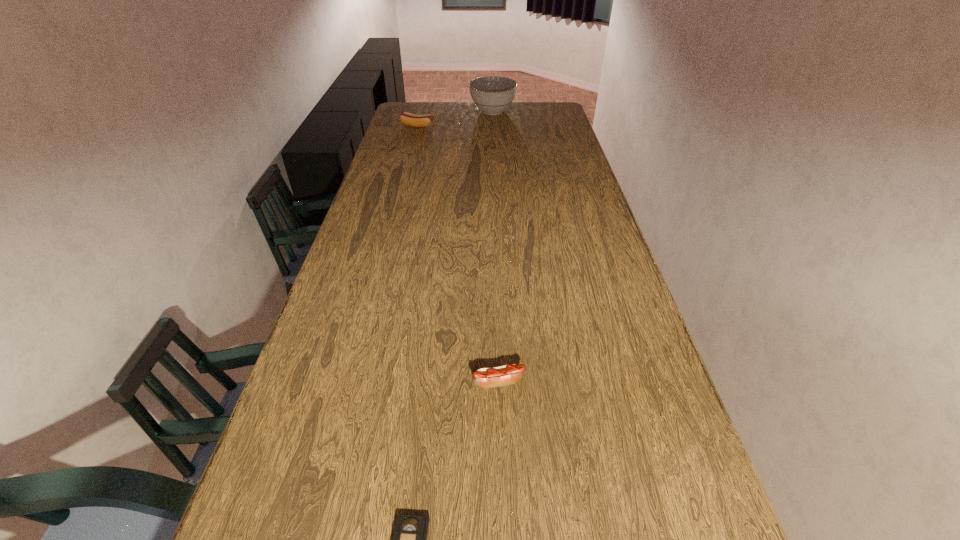
This screenshot has height=540, width=960. What are the coordinates of `the farthest object` in the screenshot? It's located at (492, 95).

Identify the location of the tallest object. (492, 95).

Identify the location of the leftmost object. The width and height of the screenshot is (960, 540). (410, 119).

This screenshot has height=540, width=960. Identify the location of the third nearest object. (410, 119).

The image size is (960, 540). What are the coordinates of `the second shortest object` in the screenshot? It's located at (509, 374).

This screenshot has height=540, width=960. In order to click on the second nearest object in this screenshot , I will do `click(509, 374)`.

You are a GUI agent. You are given a task and a screenshot of the screen. Output one action in this format:
    pyautogui.click(x=<x>, y=<y>)
    Task: Click on the blank space located 0.090m on the left of the farthest object
    The image size is (960, 540).
    Given the screenshot: What is the action you would take?
    pyautogui.click(x=451, y=111)

Find the location of `free space located 0.090m on the front of the third nearest object`. free space located 0.090m on the front of the third nearest object is located at coordinates (415, 138).

Identify the location of free space located 0.240m on the left of the second shortest object. The height and width of the screenshot is (540, 960). (367, 382).

At what (x,y) coordinates should I click in order to perform the action: click on object at the far edge. Please return your answer as a coordinate pair (x, y). The height and width of the screenshot is (540, 960). Looking at the image, I should click on (492, 95).